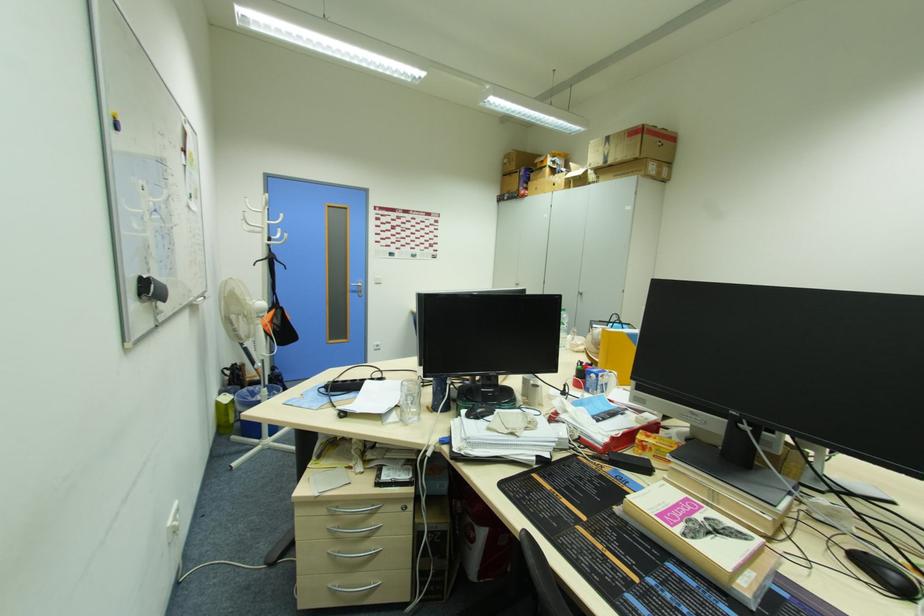
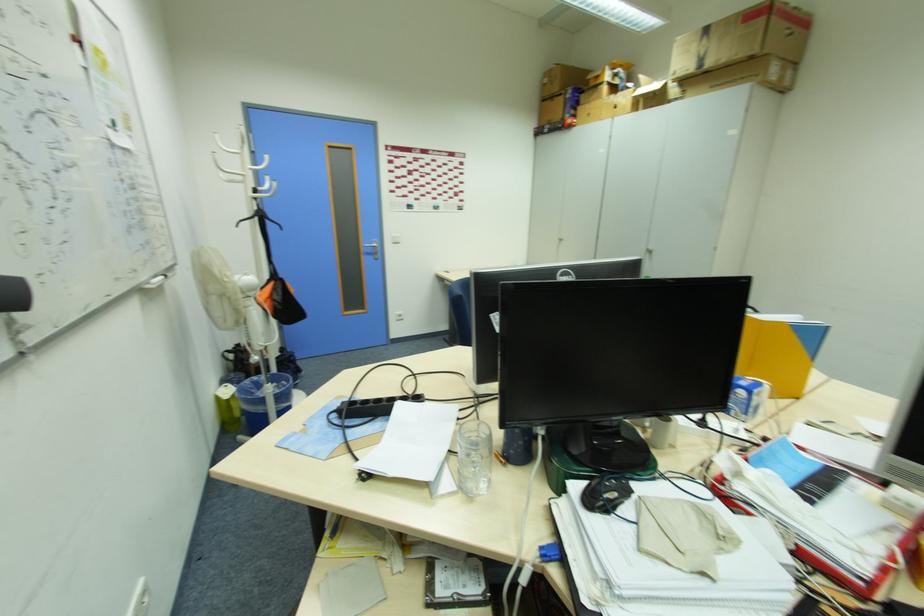
The point at (357, 285) is marked in the first image. Where is the corresponding point in the second image?

(370, 245)